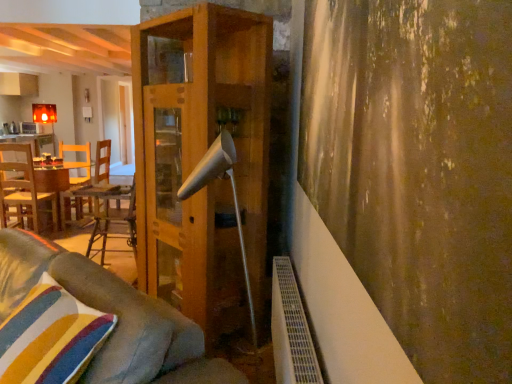
Question: Is woodenmaterial/texturetable at left, which is the second table from left to right, wider or thinner than velvet gray couch at lower left?

Choices:
 (A) thin
 (B) wide

Answer: (B)

Question: Is woodenmaterial/texturetable at left, which ranks as the first table in bottom-to-top order, situated inside velvet gray couch at lower left or outside?

Choices:
 (A) outside
 (B) inside

Answer: (A)

Question: Which is farther from the matte white cabinet at upper left?

Choices:
 (A) velvet gray couch at lower left
 (B) wooden table at left, which is the 2th table in right-to-left order
 (C) white matte lamp at center
 (D) wooden shelf at center
 (E) woodenmaterial/texturetable at left, the first table in the front-to-back sequence

Answer: (A)

Question: Which object is positioned farthest from the wooden shelf at center?

Choices:
 (A) woodenmaterial/texturetable at left, positioned as the 1th table in right-to-left order
 (B) velvet gray couch at lower left
 (C) textured brown curtain at right
 (D) wooden table at left, marked as the 1th table in a back-to-front arrangement
 (E) white matte lamp at center

Answer: (D)